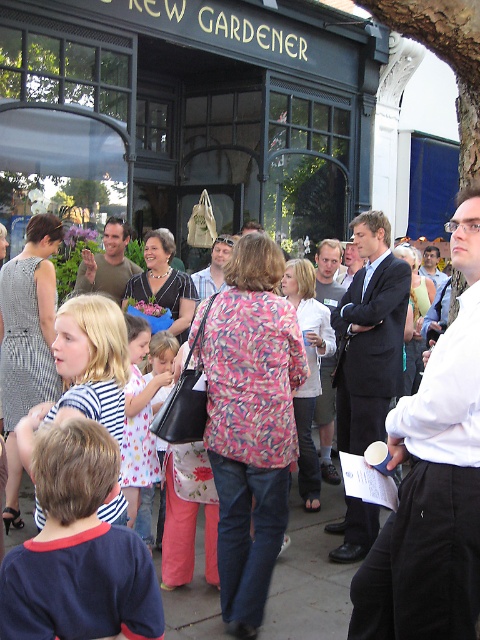
You are standing in front of the NEW GARDENER building and want to take a photo of both the point at coordinates point (11, 536) and the point at coordinates point (167, 380). Which point should you focus on first to ensure both are in the frame?

You should focus on point (11, 536) first because it is closer to you than point (167, 380), ensuring both points are within the camera frame.